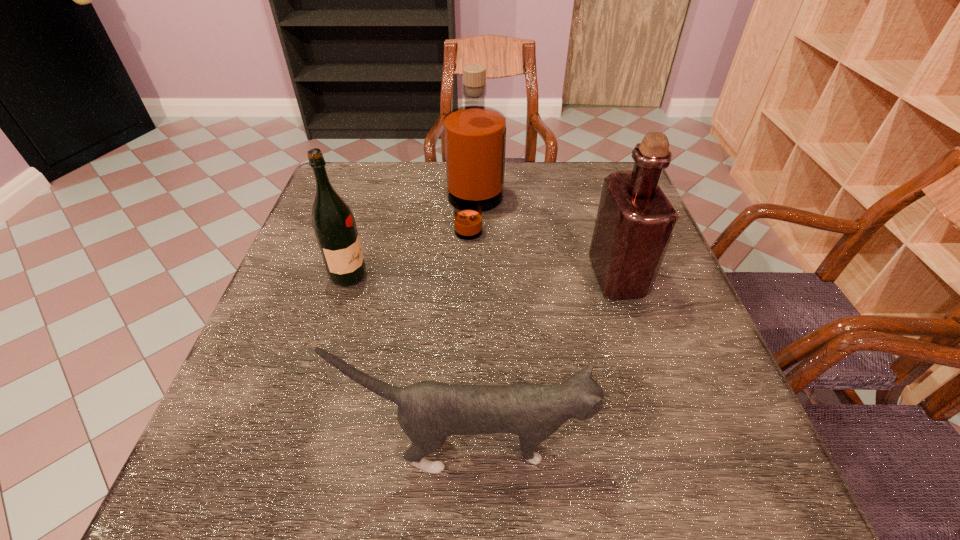
The image size is (960, 540). In order to click on the farthest liquor in this screenshot , I will do `click(474, 135)`.

Where is `the farthest object`? The height and width of the screenshot is (540, 960). the farthest object is located at coordinates tap(474, 135).

Locate an element on the screen. This screenshot has height=540, width=960. the rightmost liquor is located at coordinates click(x=635, y=221).

Locate an element on the screen. The image size is (960, 540). the leftmost object is located at coordinates (334, 225).

Find the location of `the nearest object`. the nearest object is located at coordinates (428, 412).

At what (x,y) coordinates should I click in order to perform the action: click on the shortest object. Please return your answer as a coordinate pair (x, y). Image resolution: width=960 pixels, height=540 pixels. Looking at the image, I should click on (428, 412).

Locate an element on the screen. The width and height of the screenshot is (960, 540). free space located on the front label of the farthest liquor is located at coordinates (610, 209).

Locate an element on the screen. This screenshot has height=540, width=960. free space located 0.260m on the front of the rightmost liquor is located at coordinates (664, 423).

At what (x,y) coordinates should I click in order to perform the action: click on vacant area located on the front-facing side of the leftmost object. Please return your answer as a coordinate pair (x, y). Looking at the image, I should click on (393, 276).

Where is `vacant region located at the face of the cat`? Image resolution: width=960 pixels, height=540 pixels. vacant region located at the face of the cat is located at coordinates (640, 447).